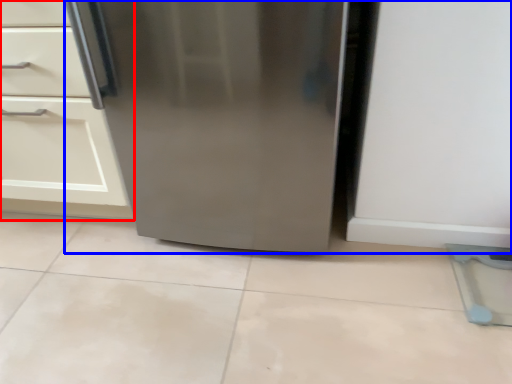
Question: Which of the following is the farthest to the observer, cabinetry (highlighted by a red box) or refrigerator (highlighted by a blue box)?

Choices:
 (A) cabinetry
 (B) refrigerator

Answer: (A)